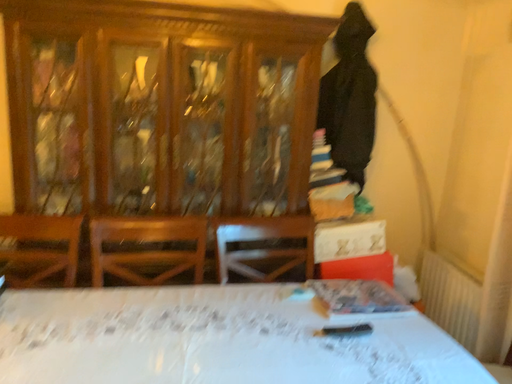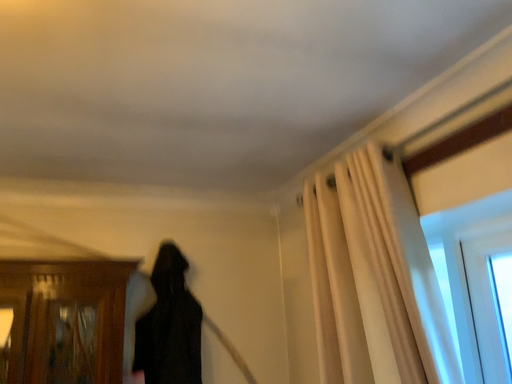
Question: Which way did the camera rotate in the video?

Choices:
 (A) rotated left
 (B) rotated right

Answer: (B)